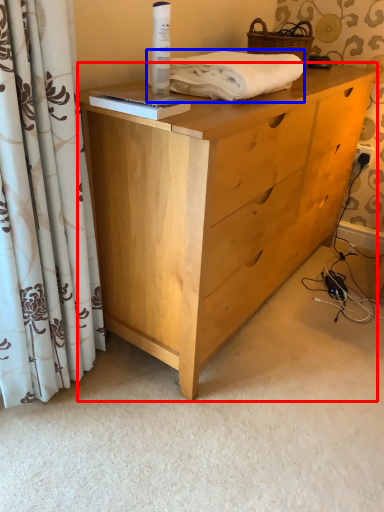
Question: Which point is further to the camera, chest of drawers (highlighted by a red box) or bath towel (highlighted by a blue box)?

Choices:
 (A) chest of drawers
 (B) bath towel

Answer: (B)